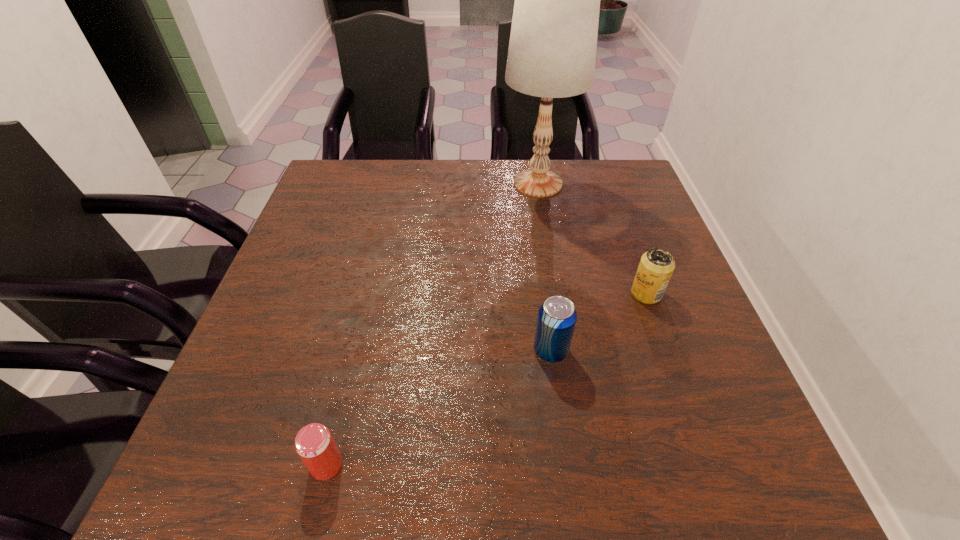
You are a GUI agent. You are given a task and a screenshot of the screen. Output one action in this format:
    pyautogui.click(x=<x>, y=<y>)
    Task: Click on the free point between the tallest object and the second farthest beer can
    Image resolution: width=960 pixels, height=540 pixels.
    Given the screenshot: What is the action you would take?
    pyautogui.click(x=544, y=267)

You are a GUI agent. You are given a task and a screenshot of the screen. Output one action in this format:
    pyautogui.click(x=<x>, y=<y>)
    Task: Click on the object that is the second closest to the tallest object
    This screenshot has width=960, height=540.
    Given the screenshot: What is the action you would take?
    pyautogui.click(x=557, y=316)

Choose which object is the third nearest neighbor to the shortest object. Please provide its 2D coordinates. Your answer should be formatted as a tuple, i.e. [(x, y)], where the tuple contains the x and y coordinates of a point satisfying the conditions above.

[(552, 50)]

Identify which beer can is located as the second nearest to the rightmost beer can. Please provide its 2D coordinates. Your answer should be formatted as a tuple, i.e. [(x, y)], where the tuple contains the x and y coordinates of a point satisfying the conditions above.

[(314, 444)]

Find the location of a particular element. Image resolution: width=960 pixels, height=540 pixels. beer can that is the second nearest to the third farthest object is located at coordinates (314, 444).

Where is `free space that satisfies the following two spatial constraints: 1. on the back side of the second beer can from right to left; 2. on the left side of the rightmost beer can`? free space that satisfies the following two spatial constraints: 1. on the back side of the second beer can from right to left; 2. on the left side of the rightmost beer can is located at coordinates (543, 293).